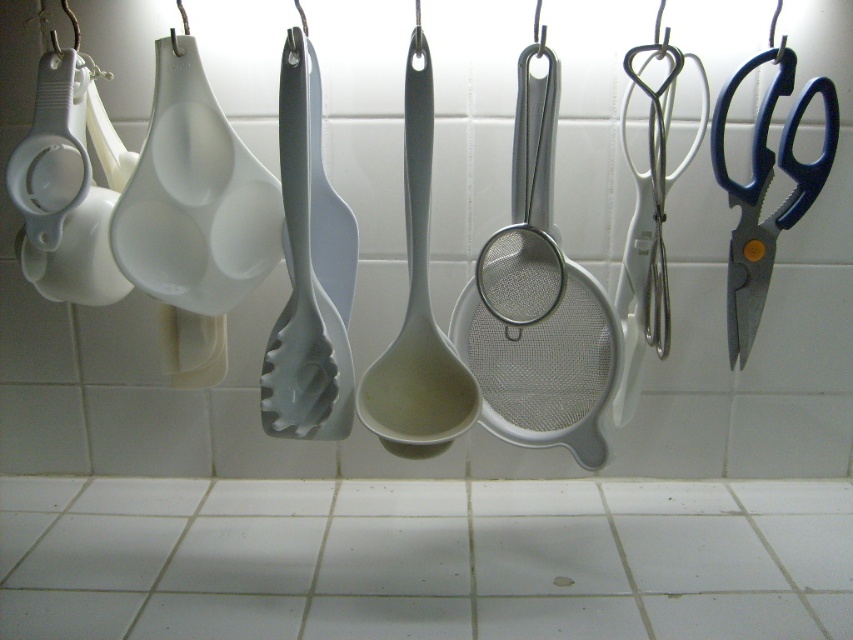
Question: Which of the following is the farthest from the observer?

Choices:
 (A) gray matte pasta server at center
 (B) blue plastic scissors at right

Answer: (B)

Question: Can you confirm if gray matte pasta server at center is positioned to the left of blue plastic scissors at right?

Choices:
 (A) no
 (B) yes

Answer: (B)

Question: Is gray matte ladle at center to the right of blue plastic scissors at right from the viewer's perspective?

Choices:
 (A) no
 (B) yes

Answer: (A)

Question: Estimate the real-world distances between objects in this image. Which object is closer to the gray matte ladle at center?

Choices:
 (A) gray matte pasta server at center
 (B) blue plastic scissors at right

Answer: (A)

Question: Can you confirm if gray matte pasta server at center is positioned above gray matte ladle at center?

Choices:
 (A) yes
 (B) no

Answer: (B)

Question: Estimate the real-world distances between objects in this image. Which object is closer to the gray matte pasta server at center?

Choices:
 (A) blue plastic scissors at right
 (B) gray matte ladle at center

Answer: (B)